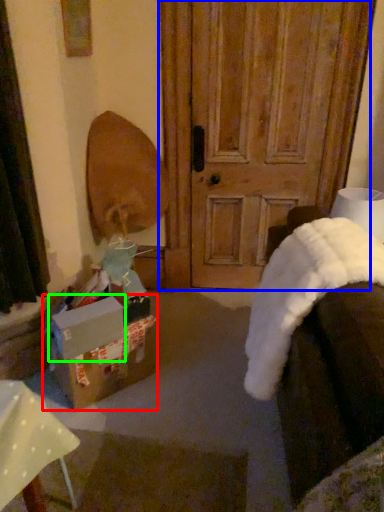
Question: Considering the real-world distances, which object is closest to box (highlighted by a red box)? door (highlighted by a blue box) or cardboard box (highlighted by a green box).

Choices:
 (A) door
 (B) cardboard box

Answer: (B)